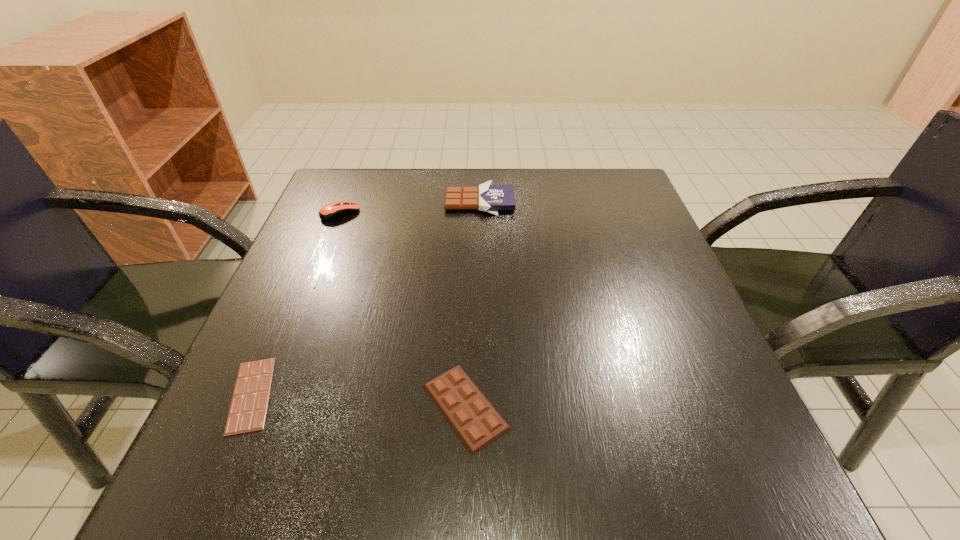
You are a GUI agent. You are given a task and a screenshot of the screen. Output one action in this format:
    pyautogui.click(x=<x>, y=<y>)
    Task: Click on the farthest chocolate bar
    Image resolution: width=960 pixels, height=540 pixels.
    Given the screenshot: What is the action you would take?
    pyautogui.click(x=489, y=198)

Where is `computer mouse`? The height and width of the screenshot is (540, 960). computer mouse is located at coordinates (333, 211).

You are a GUI agent. You are given a task and a screenshot of the screen. Output one action in this format:
    pyautogui.click(x=<x>, y=<y>)
    Task: Click on the third tallest object
    The height and width of the screenshot is (540, 960).
    Given the screenshot: What is the action you would take?
    pyautogui.click(x=476, y=422)

Locate an element on the screen. This screenshot has height=540, width=960. the leftmost chocolate bar is located at coordinates (249, 404).

The image size is (960, 540). I want to click on the shortest object, so click(x=249, y=404).

The height and width of the screenshot is (540, 960). I want to click on vacant area situated on the left of the farthest chocolate bar, so click(415, 202).

At what (x,y) coordinates should I click in order to perform the action: click on blank space located 0.390m on the front of the computer mouse. Please return your answer as a coordinate pair (x, y). Looking at the image, I should click on (276, 372).

This screenshot has height=540, width=960. I want to click on vacant area situated on the back of the second shortest object, so click(468, 274).

What are the coordinates of `blank space located on the front of the shortest object` in the screenshot? It's located at (214, 482).

This screenshot has width=960, height=540. I want to click on chocolate bar that is positioned at the far edge, so click(489, 198).